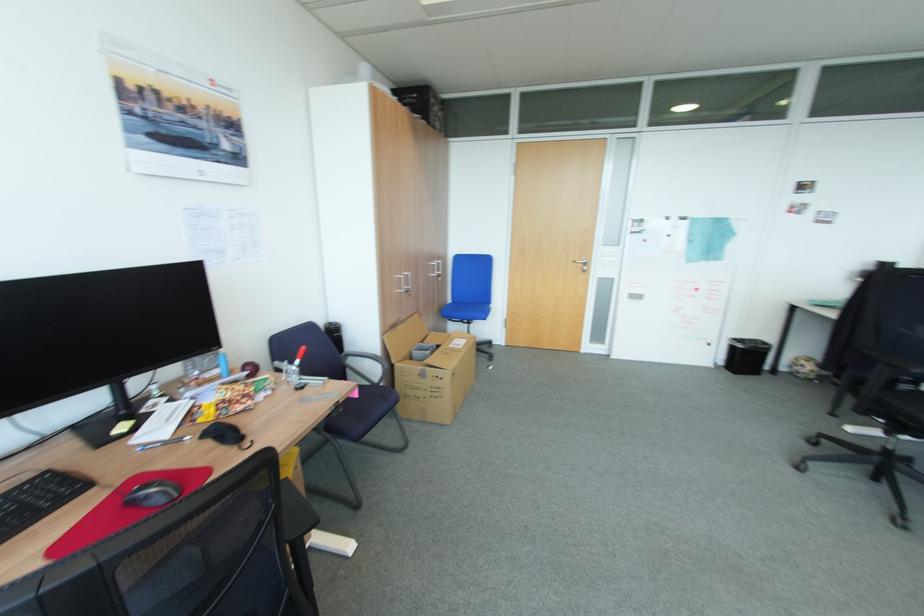
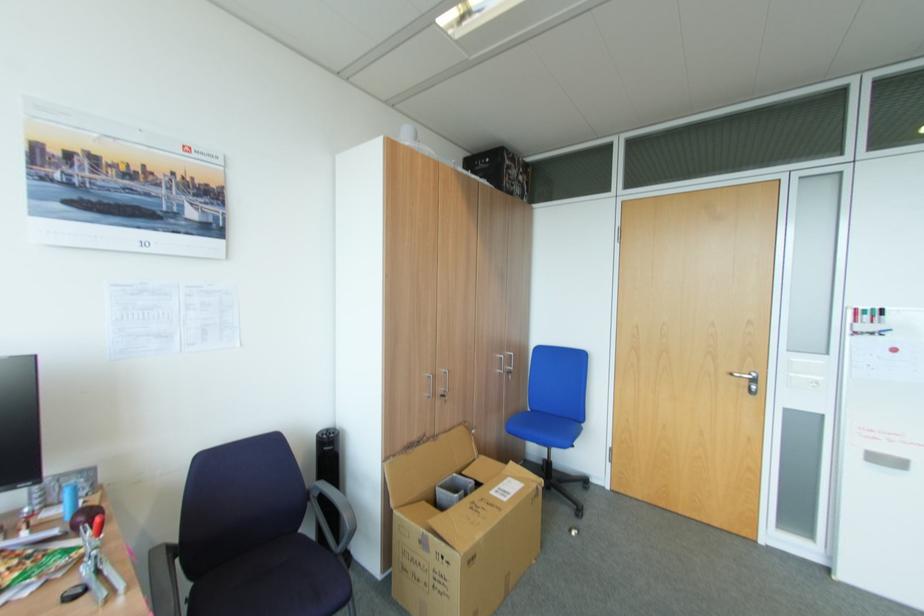
Locate, in the second image, the point that corresponds to point (438, 276) in the first image.

(505, 371)